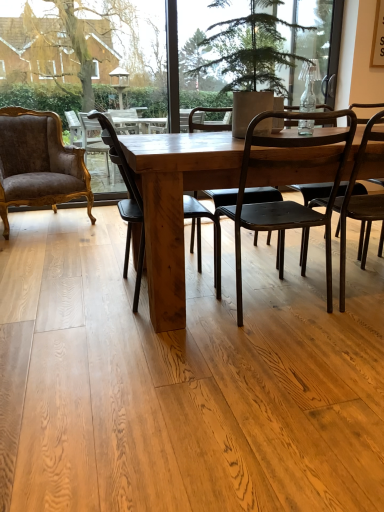
Question: Can you see green textured plant at center touching matte black chair at right, which ranks as the 1th chair in right-to-left order?

Choices:
 (A) no
 (B) yes

Answer: (A)

Question: Does green textured plant at center come behind matte black chair at right, which ranks as the 1th chair in right-to-left order?

Choices:
 (A) yes
 (B) no

Answer: (B)

Question: Is green textured plant at center wider than matte black chair at right, which ranks as the 1th chair in right-to-left order?

Choices:
 (A) no
 (B) yes

Answer: (B)

Question: Is green textured plant at center oriented towards matte black chair at right, positioned as the 4th chair in left-to-right order?

Choices:
 (A) yes
 (B) no

Answer: (B)

Question: Is green textured plant at center bigger than matte black chair at right, which ranks as the 1th chair in right-to-left order?

Choices:
 (A) yes
 (B) no

Answer: (A)

Question: From the image's perspective, would you say green textured plant at center is shown under matte black chair at right, positioned as the 4th chair in left-to-right order?

Choices:
 (A) no
 (B) yes

Answer: (A)

Question: Is matte black chair at center, which appears as the second chair when viewed from the right, to the right of wooden chair at center, which appears as the 2th chair when viewed from the left, from the viewer's perspective?

Choices:
 (A) yes
 (B) no

Answer: (A)

Question: Considering the relative sizes of matte black chair at center, which appears as the second chair when viewed from the right, and wooden chair at center, positioned as the third chair in right-to-left order, in the image provided, is matte black chair at center, which appears as the second chair when viewed from the right, bigger than wooden chair at center, positioned as the third chair in right-to-left order,?

Choices:
 (A) yes
 (B) no

Answer: (A)

Question: Is matte black chair at center, acting as the 3th chair starting from the left, not inside wooden chair at center, positioned as the third chair in right-to-left order?

Choices:
 (A) yes
 (B) no

Answer: (A)

Question: Does matte black chair at center, acting as the 3th chair starting from the left, turn towards wooden chair at center, positioned as the third chair in right-to-left order?

Choices:
 (A) no
 (B) yes

Answer: (A)

Question: Is matte black chair at center, which appears as the second chair when viewed from the right, to the left of wooden chair at center, positioned as the third chair in right-to-left order, from the viewer's perspective?

Choices:
 (A) no
 (B) yes

Answer: (A)

Question: From the image's perspective, is matte black chair at center, which appears as the second chair when viewed from the right, located beneath wooden chair at center, which appears as the 2th chair when viewed from the left?

Choices:
 (A) no
 (B) yes

Answer: (B)

Question: From a real-world perspective, does wooden chair at center, positioned as the third chair in right-to-left order, sit lower than matte black chair at center, acting as the 3th chair starting from the left?

Choices:
 (A) yes
 (B) no

Answer: (A)